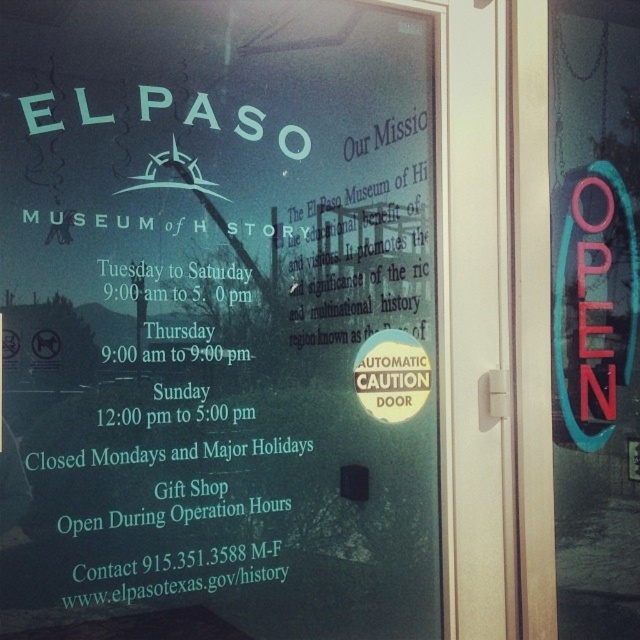
You are a visitor trying to enter the museum. You see the transparent glass sign at upper center and the neon sign at right. Which one do you need to read to know the current operating hours?

The transparent glass sign at upper center is bigger than neon sign at right, so you should read the transparent glass sign at upper center to know the current operating hours because it likely contains the detailed information about the museum hours.

You are standing in front of the glass door and want to read both the transparent glass sign at upper center and the neon sign at right. Which one can you read first without moving your head?

The transparent glass sign at upper center is closer to the viewer than the neon sign at right, so you can read the transparent glass sign at upper center first without moving your head.

You are a visitor looking for the entrance to the El Paso Museum of History. You see the transparent glass sign at upper center and the neon sign at right. Which one is positioned lower?

The transparent glass sign at upper center is positioned below the neon sign at right, so it is lower.